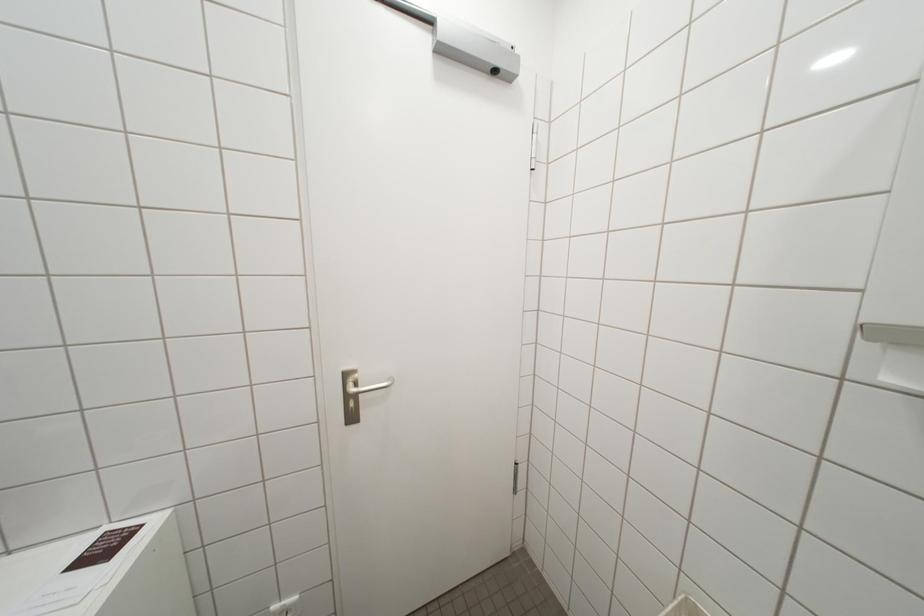
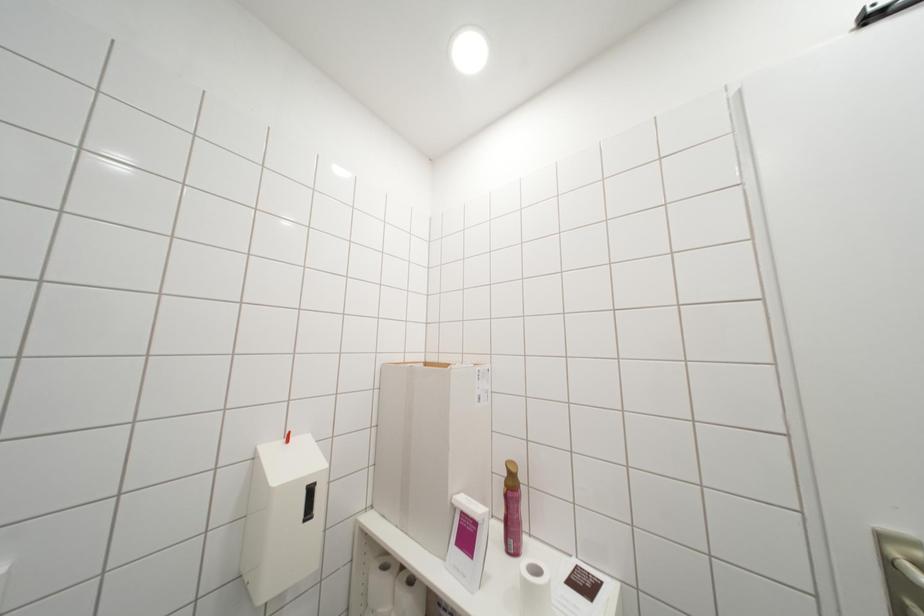
Question: The camera is either moving clockwise (left) or counter-clockwise (right) around the object. The first image is from the beginning of the video and the second image is from the end. Is the camera moving left or right when shooting the video?

Choices:
 (A) Left
 (B) Right

Answer: (B)